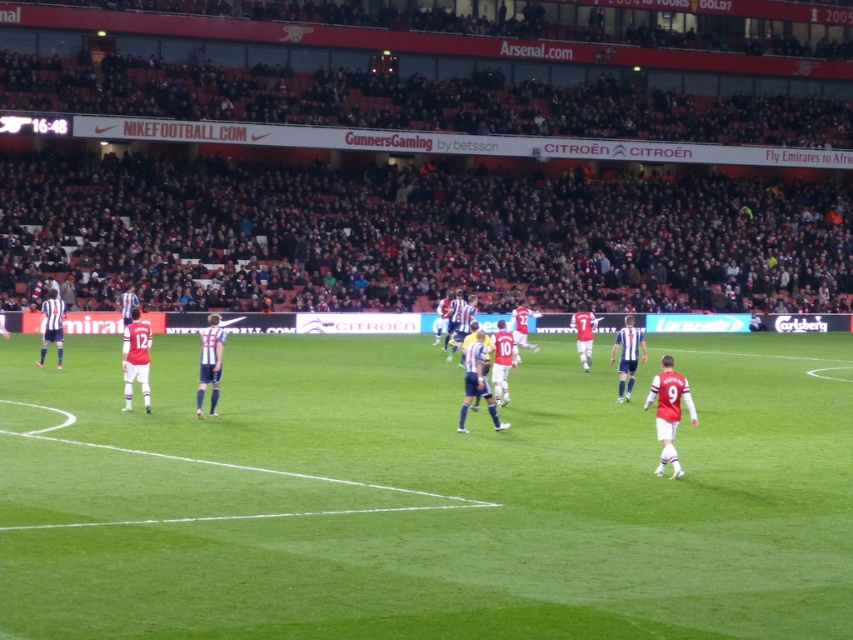
Question: Does green grass football field at center have a greater width compared to white jersey at center?

Choices:
 (A) yes
 (B) no

Answer: (A)

Question: Among these objects, which one is nearest to the camera?

Choices:
 (A) white jersey at center
 (B) dark gray crowd at upper center

Answer: (A)

Question: Does green grass football field at center appear on the right side of dark gray crowd at upper center?

Choices:
 (A) yes
 (B) no

Answer: (B)

Question: Which point is closer to the camera?

Choices:
 (A) (51, 310)
 (B) (846, 308)
 (C) (270, 593)

Answer: (C)

Question: Does white jersey at center have a larger size compared to striped jersey at left?

Choices:
 (A) no
 (B) yes

Answer: (A)

Question: Based on their relative distances, which object is nearer to the white jersey at center?

Choices:
 (A) dark gray crowd at upper center
 (B) green grass football field at center
 (C) striped jersey at left

Answer: (B)